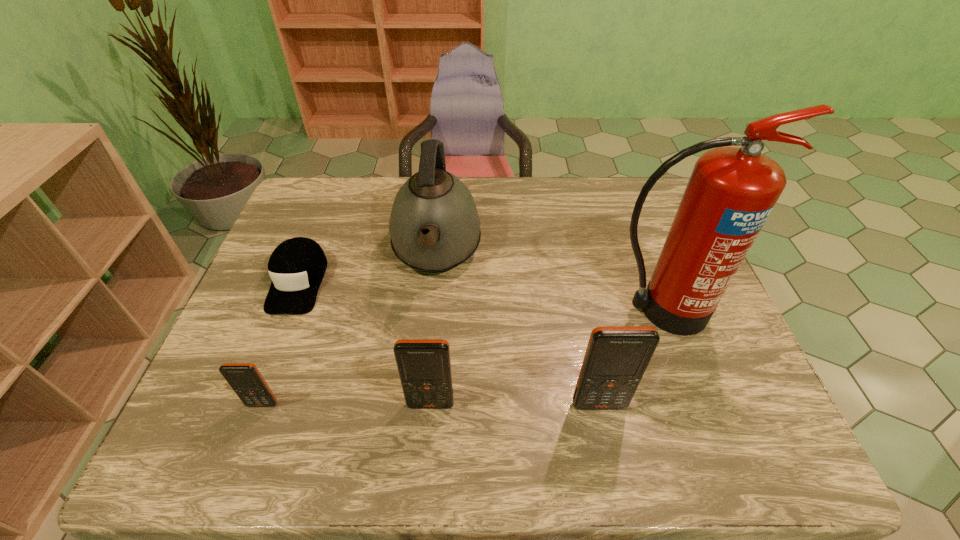
Find the location of `vacant point located between the tallest object and the second cellular telephone from left to right`. vacant point located between the tallest object and the second cellular telephone from left to right is located at coordinates (545, 357).

Find the location of a particular element. The width and height of the screenshot is (960, 540). free space that is in between the kettle and the fire extinguisher is located at coordinates (548, 281).

The width and height of the screenshot is (960, 540). I want to click on the fifth closest object relative to the second cellular telephone from left to right, so click(731, 192).

Locate an element on the screen. object that stands as the fifth closest to the tallest object is located at coordinates (245, 379).

Choose which cellular telephone is the nearest neighbor to the kettle. Please provide its 2D coordinates. Your answer should be formatted as a tuple, i.e. [(x, y)], where the tuple contains the x and y coordinates of a point satisfying the conditions above.

[(424, 365)]

Select which cellular telephone is the closest to the fourth tallest object. Please provide its 2D coordinates. Your answer should be formatted as a tuple, i.e. [(x, y)], where the tuple contains the x and y coordinates of a point satisfying the conditions above.

[(616, 358)]